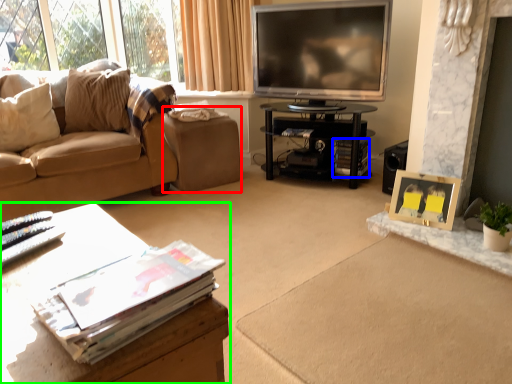
Question: Based on their relative distances, which object is nearer to footrest (highlighted by a red box)? Choose from magazine (highlighted by a blue box) and table (highlighted by a green box).

Choices:
 (A) magazine
 (B) table

Answer: (A)